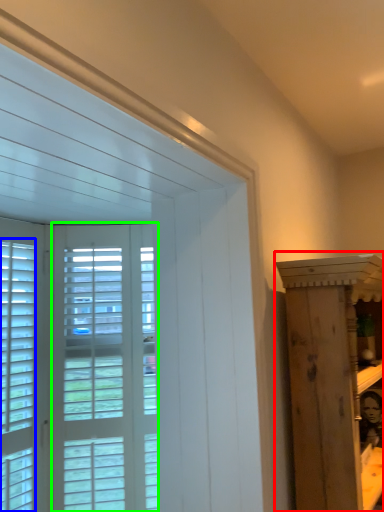
Question: Which is farther away from furniture (highlighted by a red box)? window (highlighted by a blue box) or screen door (highlighted by a green box)?

Choices:
 (A) window
 (B) screen door

Answer: (A)